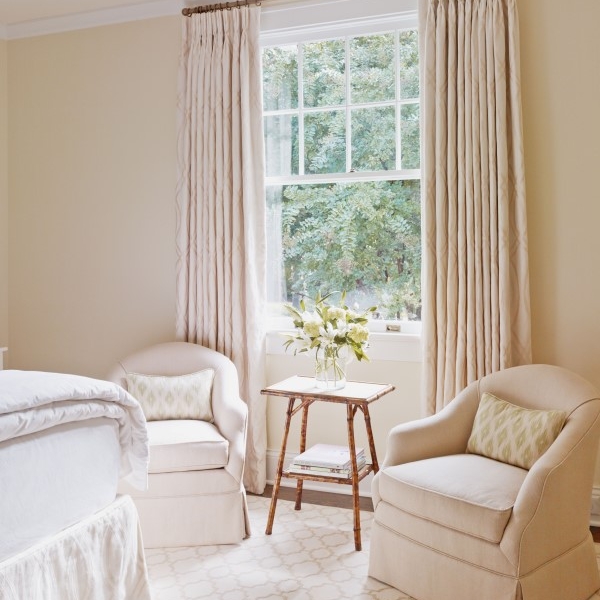
Where is `blank beige walls`? This screenshot has width=600, height=600. blank beige walls is located at coordinates tap(84, 192), tap(571, 177).